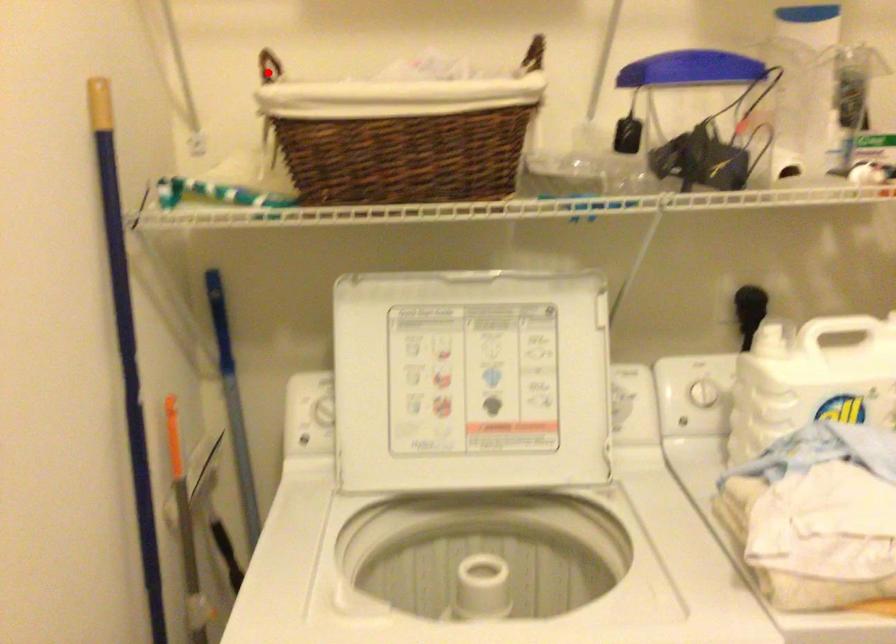
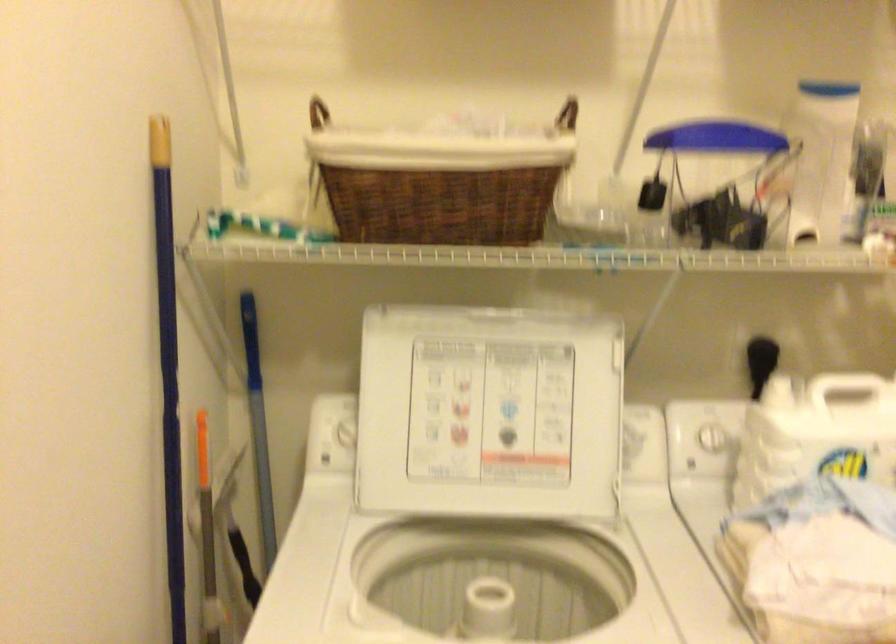
Find the pixel in the second image that matches the highlighted location in the first image.

(317, 113)